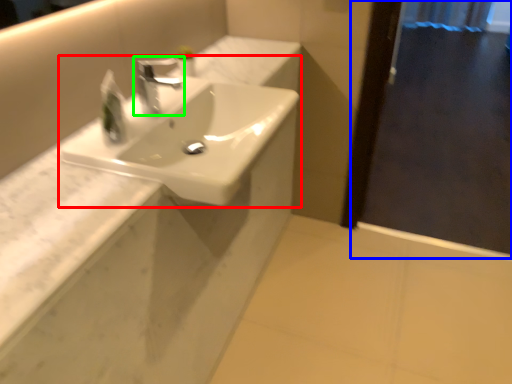
Question: Based on their relative distances, which object is nearer to sink (highlighted by a red box)? Choose from screen door (highlighted by a blue box) and tap (highlighted by a green box).

Choices:
 (A) screen door
 (B) tap

Answer: (B)